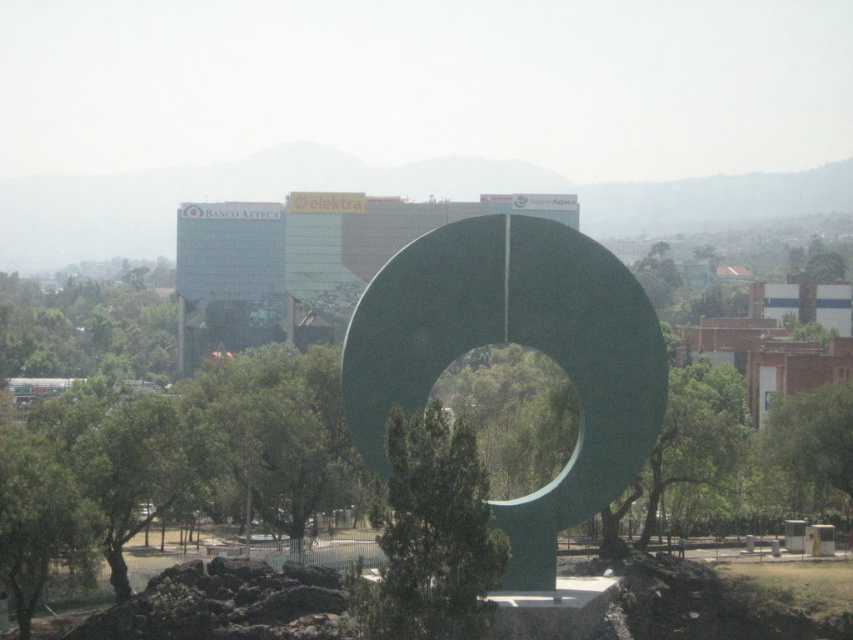
You are an architect evaluating the outdoor space. You need to determine if the green leafy tree at center will block the view of the green polished stone sculpture at center from the main entrance. Based on their heights, what is your assessment?

The green polished stone sculpture at center is taller than the green leafy tree at center, so the sculpture will remain visible above the tree, ensuring an unobstructed view from the main entrance.

You are an urban planner evaluating the central park layout. The green polished stone sculpture at center and the green matte tree at center are both at the park center. Which one has a greater width?

The green polished stone sculpture at center has a greater width than the green matte tree at center.

From the picture: You are standing in the park and want to take a photo of the green leafy tree at center without the green polished stone sculpture at center blocking the view. Is there a way to position yourself so that the sculpture does not obscure the tree?

The green polished stone sculpture at center is located above the green leafy tree at center, so if you position yourself lower or move to a position where the sculpture is not directly in front of the tree, you can capture the tree without obstruction.